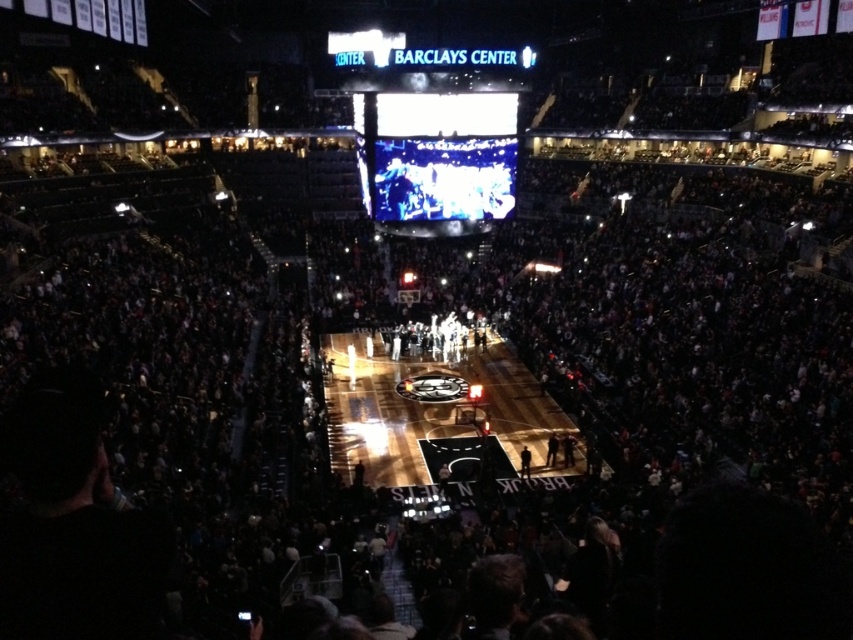
The height and width of the screenshot is (640, 853). What do you see at coordinates (434, 410) in the screenshot?
I see `glossy wooden court at center` at bounding box center [434, 410].

This screenshot has width=853, height=640. Find the location of `glossy wooden court at center`. glossy wooden court at center is located at coordinates (434, 410).

Identify the location of glossy wooden court at center. This screenshot has height=640, width=853. (434, 410).

Does dark gray fabric jacket at center have a greater width compared to dark brown leather jacket at center?

In fact, dark gray fabric jacket at center might be narrower than dark brown leather jacket at center.

Between dark gray fabric jacket at center and dark brown leather jacket at center, which one is positioned lower?

dark brown leather jacket at center is lower down.

Between point (555, 460) and point (529, 451), which one is positioned behind?

The point (529, 451) is behind.

This screenshot has height=640, width=853. I want to click on dark gray fabric jacket at center, so click(x=550, y=449).

Between point (347, 472) and point (524, 461), which one is positioned in front?

Point (347, 472)

From the picture: Who is positioned more to the left, glossy wooden court at center or dark brown leather jacket at center?

glossy wooden court at center

Who is more distant from viewer, (347, 360) or (523, 468)?

Positioned behind is point (347, 360).

You are a GUI agent. You are given a task and a screenshot of the screen. Output one action in this format:
    pyautogui.click(x=<x>, y=<y>)
    Task: Click on the glossy wooden court at center
    Image resolution: width=853 pixels, height=640 pixels.
    Given the screenshot: What is the action you would take?
    pyautogui.click(x=434, y=410)